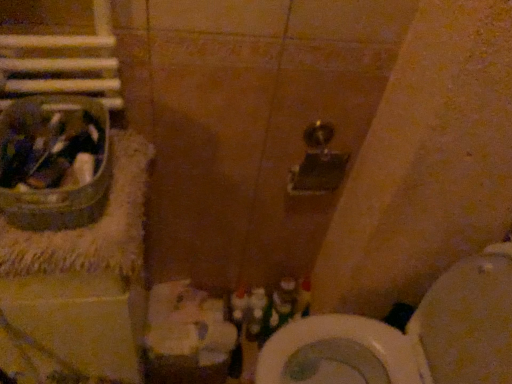
Question: From a real-world perspective, is white glossy toilet at lower right physically located above or below metallic silver sink at left?

Choices:
 (A) above
 (B) below

Answer: (B)

Question: Choose the correct answer: Is white glossy toilet at lower right inside metallic silver sink at left or outside it?

Choices:
 (A) outside
 (B) inside

Answer: (A)

Question: From the image's perspective, relative to metallic silver sink at left, is white glossy toilet at lower right above or below?

Choices:
 (A) above
 (B) below

Answer: (B)

Question: Relative to white glossy toilet at lower right, is metallic silver sink at left in front or behind?

Choices:
 (A) front
 (B) behind

Answer: (A)

Question: Does point (29, 221) appear closer or farther from the camera than point (465, 370)?

Choices:
 (A) farther
 (B) closer

Answer: (B)

Question: Visually, is metallic silver sink at left positioned to the left or to the right of white glossy toilet at lower right?

Choices:
 (A) right
 (B) left

Answer: (B)

Question: Is metallic silver sink at left wider or thinner than white glossy toilet at lower right?

Choices:
 (A) wide
 (B) thin

Answer: (B)